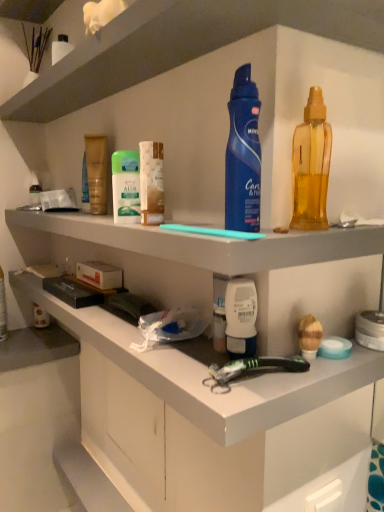
This screenshot has width=384, height=512. I want to click on vacant space to the right of blue matte deodorant at center, which ranks as the first cleaning product in left-to-right order, so tap(309, 231).